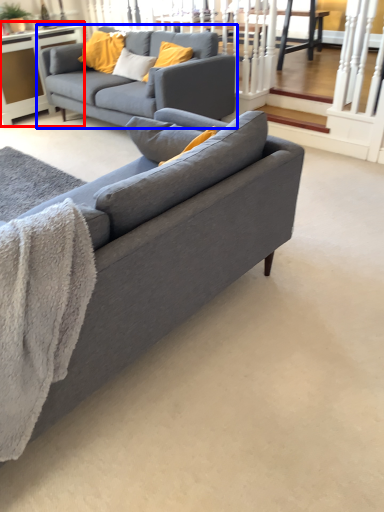
Question: Which object appears farthest to the camera in this image, table (highlighted by a red box) or studio couch (highlighted by a blue box)?

Choices:
 (A) table
 (B) studio couch

Answer: (A)